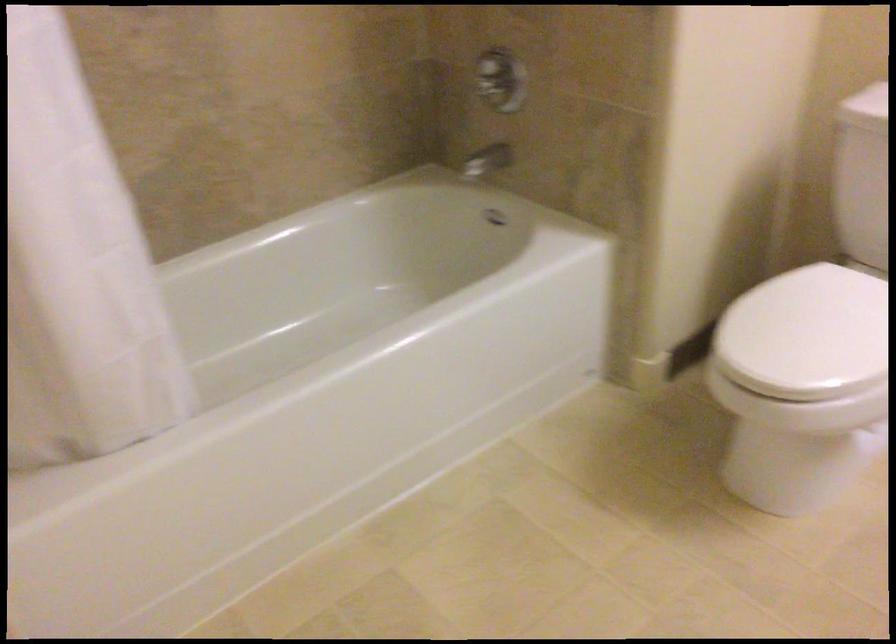
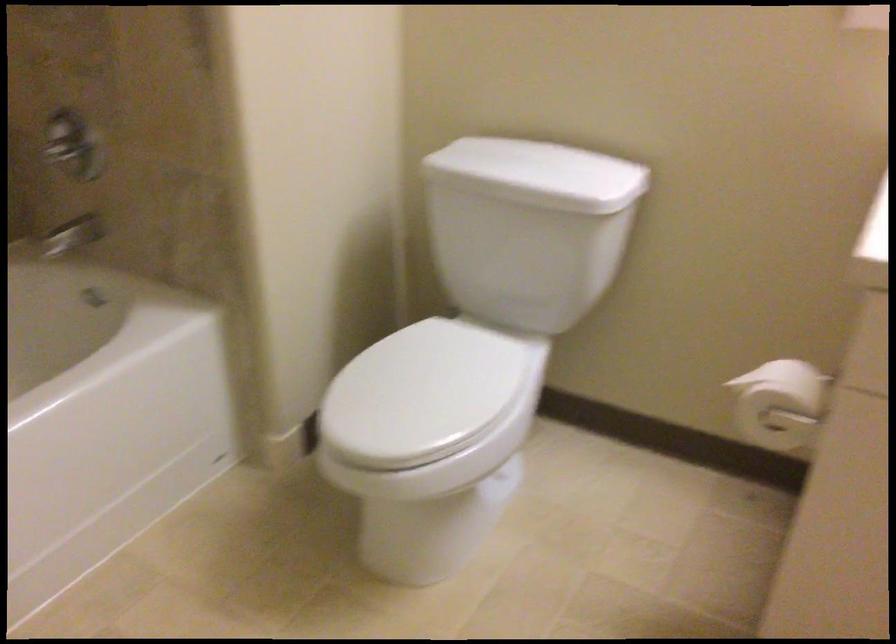
Question: Which direction would the cameraman need to move to produce the second image? Reply with the corresponding letter.

Choices:
 (A) Left
 (B) Right
 (C) Forward
 (D) Backward

Answer: (B)